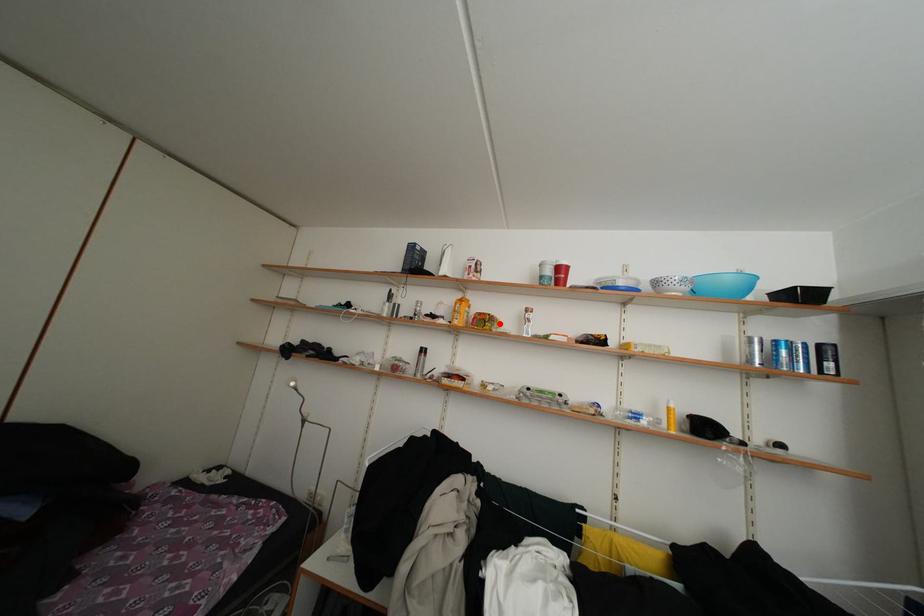
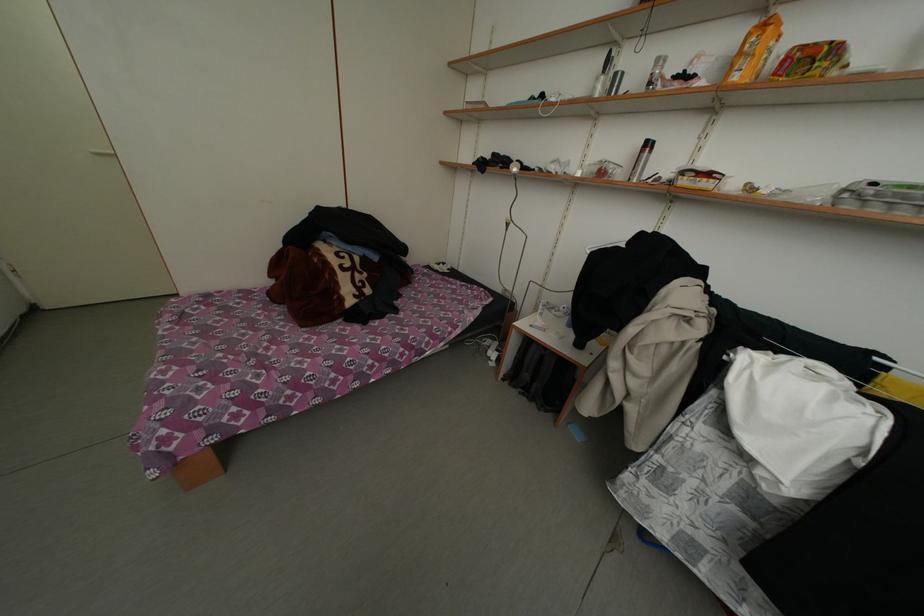
In the second image, find the point that corresponds to the highlighted location in the first image.

(845, 55)